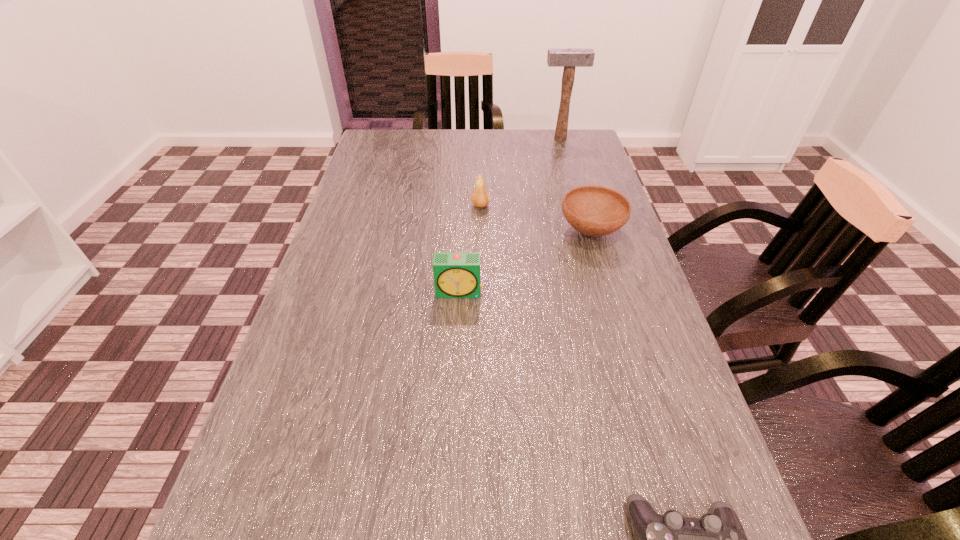
Where is `mallet`? The width and height of the screenshot is (960, 540). mallet is located at coordinates (569, 58).

What are the coordinates of `the tallest object` in the screenshot? It's located at (569, 58).

Locate an element on the screen. The height and width of the screenshot is (540, 960). the second nearest object is located at coordinates (456, 274).

This screenshot has height=540, width=960. In order to click on the second farthest object in this screenshot , I will do `click(480, 197)`.

This screenshot has height=540, width=960. I want to click on the third farthest object, so click(x=592, y=210).

Identify the location of vacant space located on the left of the tallest object. (440, 138).

The width and height of the screenshot is (960, 540). Find the location of `free space located on the front-facing side of the alarm clock`. free space located on the front-facing side of the alarm clock is located at coordinates (455, 385).

Locate an element on the screen. The image size is (960, 540). vacant space located 0.400m on the front of the pear is located at coordinates (481, 322).

Find the location of `free space located 0.270m on the left of the third nearest object`. free space located 0.270m on the left of the third nearest object is located at coordinates (455, 232).

Where is `object situated at the far edge`? This screenshot has height=540, width=960. object situated at the far edge is located at coordinates (569, 58).